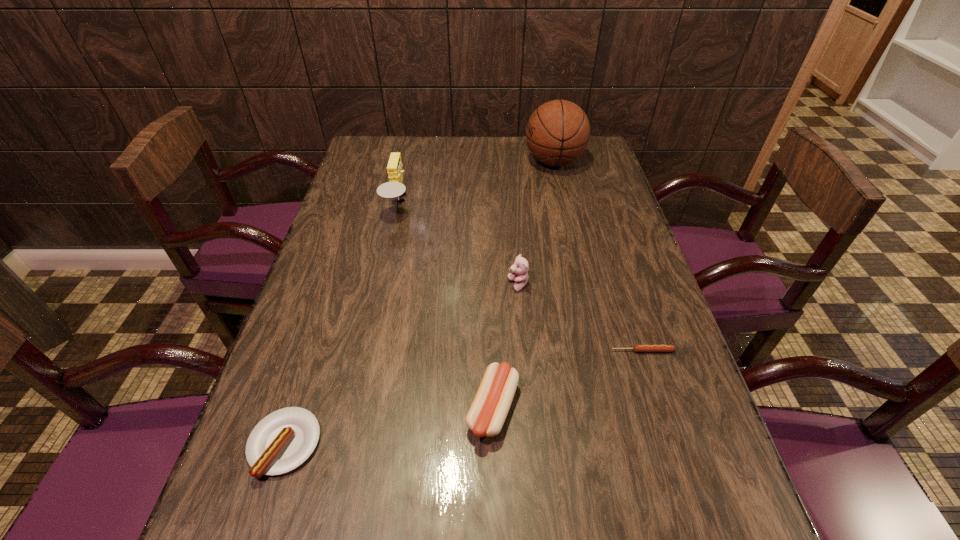
Where is `vacant space at the right edge`? vacant space at the right edge is located at coordinates (705, 433).

The width and height of the screenshot is (960, 540). In the image, there is a desktop. In order to click on free space at the far left corner in this screenshot , I will do `click(378, 142)`.

Image resolution: width=960 pixels, height=540 pixels. Find the location of `empty location between the second tallest sausage and the fourth nearest object`. empty location between the second tallest sausage and the fourth nearest object is located at coordinates (401, 364).

The height and width of the screenshot is (540, 960). Identify the location of free point between the second sausage from right to left and the rightmost sausage. (567, 380).

Identify the location of empty location between the rightmost sausage and the basketball. (598, 256).

Where is `free spot between the farthest sausage and the tallest sausage`? free spot between the farthest sausage and the tallest sausage is located at coordinates (567, 380).

Locate an element on the screen. This screenshot has height=540, width=960. vacant space in between the farthest sausage and the basketball is located at coordinates (598, 256).

The width and height of the screenshot is (960, 540). What are the coordinates of `vacant area that lies between the teddy bear and the second tallest sausage` in the screenshot? It's located at (401, 364).

The height and width of the screenshot is (540, 960). What are the coordinates of `unoccupied position between the second shortest object and the fourth nearest object` in the screenshot? It's located at (401, 364).

I want to click on free area in between the third tallest object and the second sausage from right to left, so click(x=506, y=347).